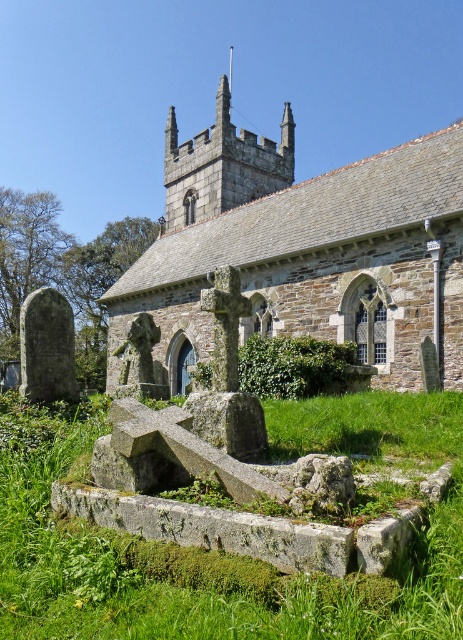
Question: Observing the image, what is the correct spatial positioning of stone church at center in reference to green mossy stone at center?

Choices:
 (A) below
 (B) above

Answer: (B)

Question: Can you confirm if stone church at center is wider than green mossy stone at center?

Choices:
 (A) yes
 (B) no

Answer: (A)

Question: Is stone church at center wider than green mossy stone at center?

Choices:
 (A) no
 (B) yes

Answer: (B)